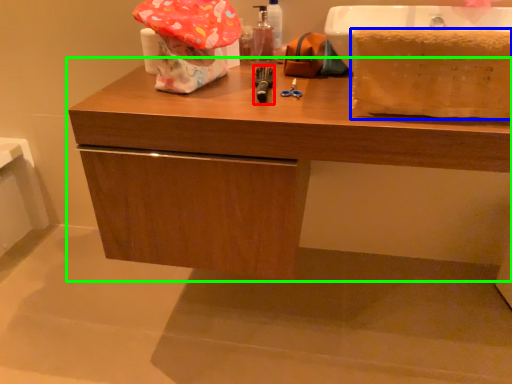
Question: Estimate the real-world distances between objects in this image. Which object is closer to tool (highlighted by a red box), blanket (highlighted by a blue box) or bathroom cabinet (highlighted by a green box)?

Choices:
 (A) blanket
 (B) bathroom cabinet

Answer: (B)